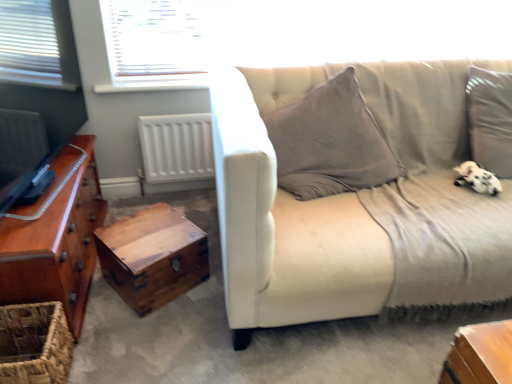
You are a GUI agent. You are given a task and a screenshot of the screen. Output one action in this format:
    pyautogui.click(x=<x>, y=<y>)
    Task: Click on the vacant area located to the right-hand side of woven brown basket at lower left
    The width and height of the screenshot is (512, 384).
    Given the screenshot: What is the action you would take?
    pyautogui.click(x=110, y=356)